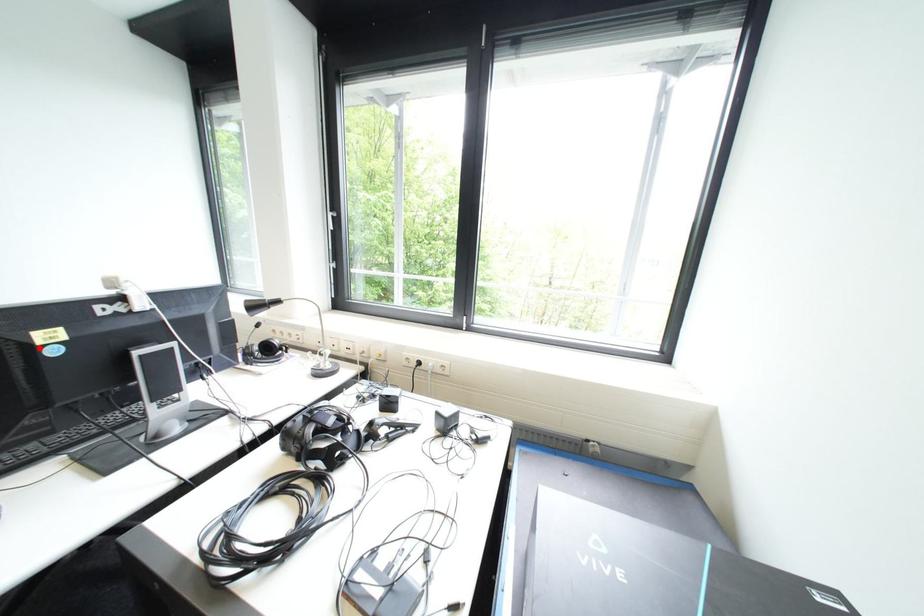
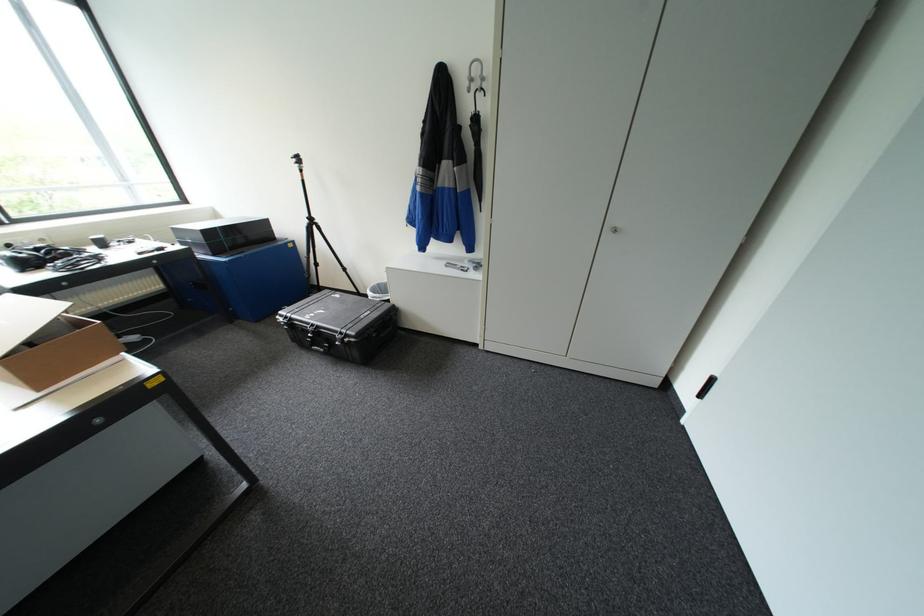
Question: I am providing you with two images of the same scene from different viewpoints. A red point is marked on the first image. Can you still see the location of the red point in image 2?

Choices:
 (A) Yes
 (B) No

Answer: (B)